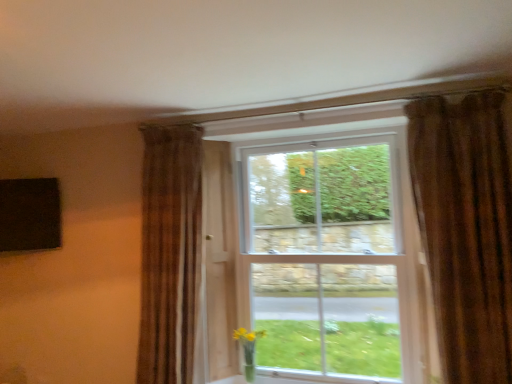
Question: Based on their positions, is brown textured curtain at left, positioned as the first curtain in back-to-front order, located to the left or right of translucent glass vase at lower right?

Choices:
 (A) right
 (B) left

Answer: (B)

Question: Based on their sizes in the image, would you say brown textured curtain at left, positioned as the first curtain in back-to-front order, is bigger or smaller than translucent glass vase at lower right?

Choices:
 (A) small
 (B) big

Answer: (B)

Question: Estimate the real-world distances between objects in this image. Which object is farther from the white glass window at center?

Choices:
 (A) brown textured curtain at left, which appears as the second curtain when viewed from the right
 (B) translucent glass vase at lower right
 (C) brown textured curtain at upper right, marked as the second curtain in a left-to-right arrangement

Answer: (B)

Question: Which is farther from the translucent glass vase at lower right?

Choices:
 (A) brown textured curtain at left, positioned as the first curtain in back-to-front order
 (B) brown textured curtain at upper right, marked as the second curtain in a left-to-right arrangement
 (C) white glass window at center

Answer: (B)